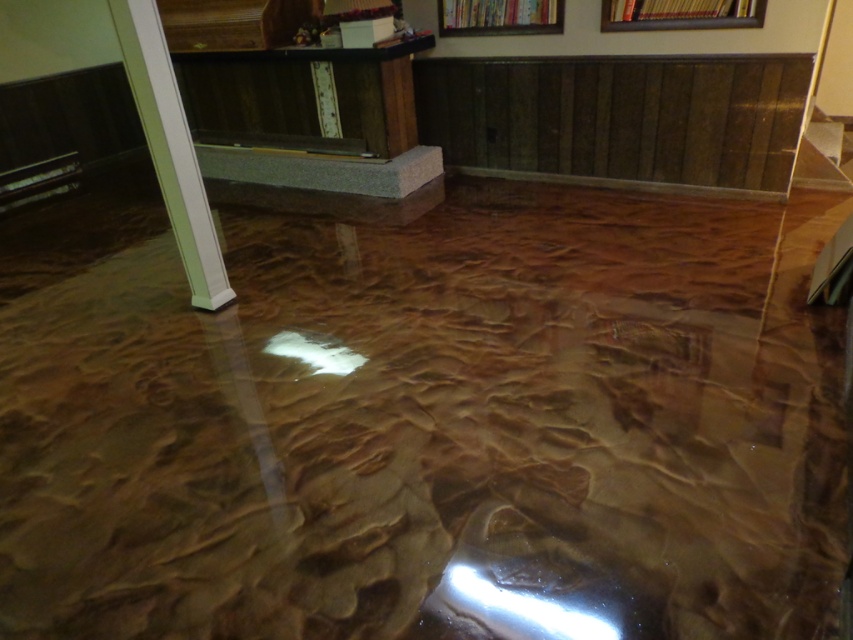
You are an interior designer assessing the space. You notice the white glossy pillar at left and the metallic gold picture frame at upper center. Which object has a greater height in the room?

The white glossy pillar at left is much taller than the metallic gold picture frame at upper center, so the pillar has a greater height.